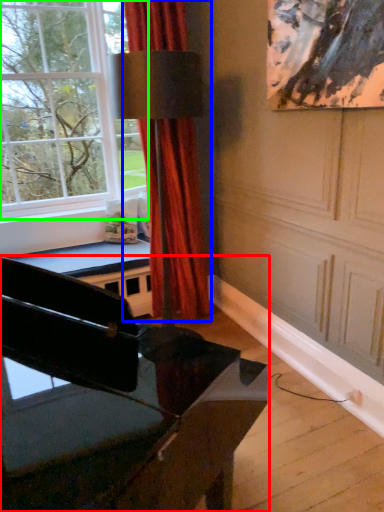
Question: Based on their relative distances, which object is farther from piano (highlighted by a red box)? Choose from curtain (highlighted by a blue box) and window (highlighted by a green box).

Choices:
 (A) curtain
 (B) window

Answer: (B)